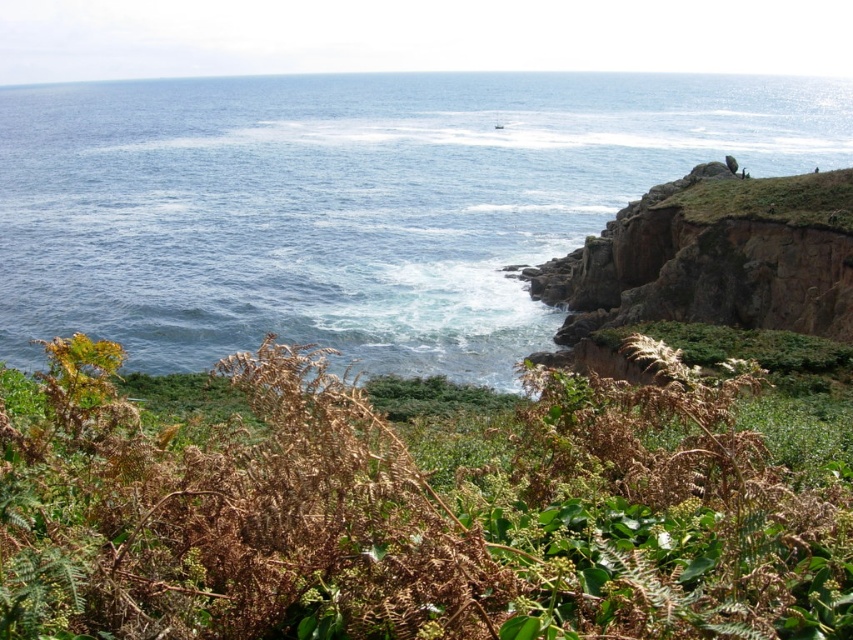
You are a photographer standing at the edge of the cliff, and you want to capture both the point at coordinates point (x=614, y=84) and point (x=659, y=292) in your photo. Based on their positions, which point will appear closer to the front of the image?

Point (x=614, y=84) is further to the camera than point (x=659, y=292), so it will appear closer to the front of the image.